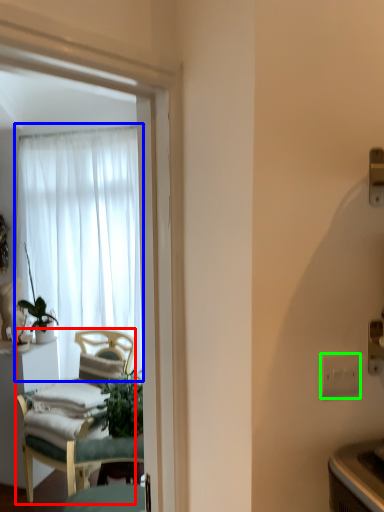
Question: Which object is the farthest from chair (highlighted by a red box)? Choose among these: curtain (highlighted by a blue box) or electric outlet (highlighted by a green box).

Choices:
 (A) curtain
 (B) electric outlet

Answer: (B)